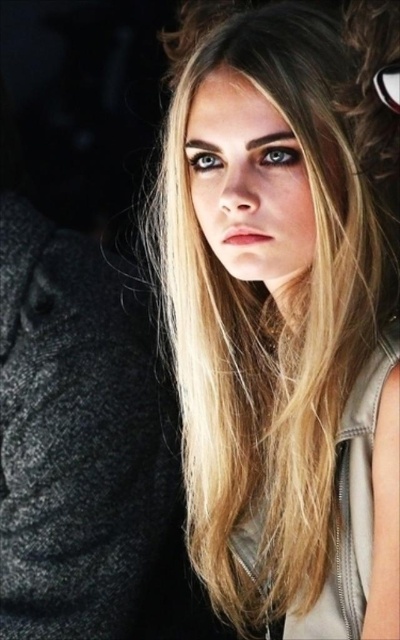
Question: Does blonde hair at center lie behind black plastic goggles at upper right?

Choices:
 (A) yes
 (B) no

Answer: (A)

Question: In this image, where is blonde hair at center located relative to black plastic goggles at upper right?

Choices:
 (A) right
 (B) left

Answer: (B)

Question: Which of the following is the closest to the observer?

Choices:
 (A) black plastic goggles at upper right
 (B) blonde hair at center

Answer: (A)

Question: Does blonde hair at center have a greater width compared to black plastic goggles at upper right?

Choices:
 (A) yes
 (B) no

Answer: (A)